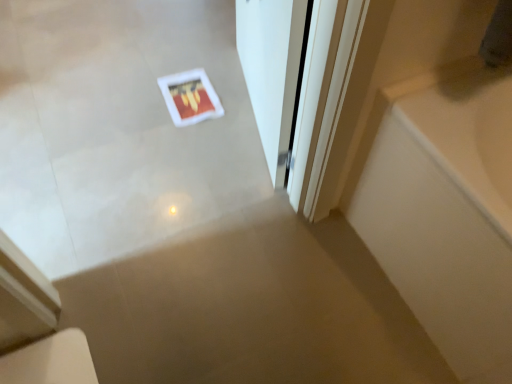
Question: Considering the relative sizes of white glossy bathtub at right and white glossy door at center in the image provided, is white glossy bathtub at right bigger than white glossy door at center?

Choices:
 (A) yes
 (B) no

Answer: (A)

Question: Does white glossy bathtub at right have a lesser height compared to white glossy door at center?

Choices:
 (A) yes
 (B) no

Answer: (A)

Question: From a real-world perspective, is white glossy bathtub at right below white glossy door at center?

Choices:
 (A) yes
 (B) no

Answer: (A)

Question: Considering the relative sizes of white glossy bathtub at right and white glossy door at center in the image provided, is white glossy bathtub at right wider than white glossy door at center?

Choices:
 (A) no
 (B) yes

Answer: (B)

Question: Does white glossy bathtub at right appear on the right side of white glossy door at center?

Choices:
 (A) no
 (B) yes

Answer: (B)

Question: Are white glossy bathtub at right and white glossy door at center located far from each other?

Choices:
 (A) no
 (B) yes

Answer: (A)

Question: Can you confirm if white glossy door at center is taller than white glossy bathtub at right?

Choices:
 (A) yes
 (B) no

Answer: (A)

Question: Does white glossy door at center come behind white glossy bathtub at right?

Choices:
 (A) no
 (B) yes

Answer: (B)

Question: Is white glossy door at center wider than white glossy bathtub at right?

Choices:
 (A) no
 (B) yes

Answer: (A)

Question: From a real-world perspective, is white glossy door at center over white glossy bathtub at right?

Choices:
 (A) yes
 (B) no

Answer: (A)

Question: Is white glossy door at center outside of white glossy bathtub at right?

Choices:
 (A) yes
 (B) no

Answer: (A)

Question: Considering the relative positions of white glossy door at center and white glossy bathtub at right in the image provided, is white glossy door at center in front of white glossy bathtub at right?

Choices:
 (A) no
 (B) yes

Answer: (A)

Question: Would you say white glossy door at center is to the left or to the right of white glossy bathtub at right in the picture?

Choices:
 (A) left
 (B) right

Answer: (A)